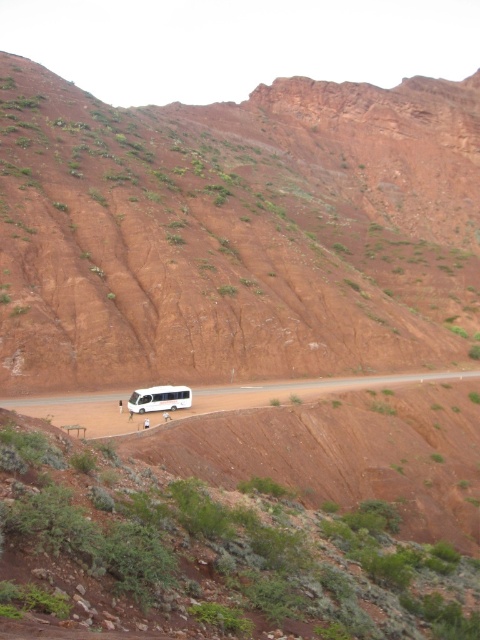
Locate an element on the screen. dull reddish-brown rock at center is located at coordinates (235, 230).

From the picture: Is dull reddish-brown rock at center closer to camera compared to white matte tour bus at center?

No, dull reddish-brown rock at center is further to the viewer.

Which is in front, point (311, 141) or point (189, 396)?

Point (189, 396) is more forward.

Where is `dull reddish-brown rock at center`? This screenshot has width=480, height=640. dull reddish-brown rock at center is located at coordinates click(x=235, y=230).

Between point (351, 323) and point (110, 426), which one is positioned behind?

Positioned behind is point (351, 323).

Is point (261, 278) positioned before point (120, 394)?

No.

Identify the location of dull reddish-brown rock at center. This screenshot has height=640, width=480. 235,230.

Between point (90, 429) and point (162, 394), which one is positioned in front?

Point (90, 429) is in front.

Is white matte dirt track at center above white matte tour bus at center?

No, white matte dirt track at center is not above white matte tour bus at center.

Measure the distance between point (83, 408) and camera.

Point (83, 408) is 58.30 meters from camera.

You are a GUI agent. You are given a task and a screenshot of the screen. Output one action in this format:
    pyautogui.click(x=<x>, y=<y>)
    Task: Click on the white matte dirt track at center
    The image size is (480, 640).
    Given the screenshot: What is the action you would take?
    pyautogui.click(x=304, y=390)